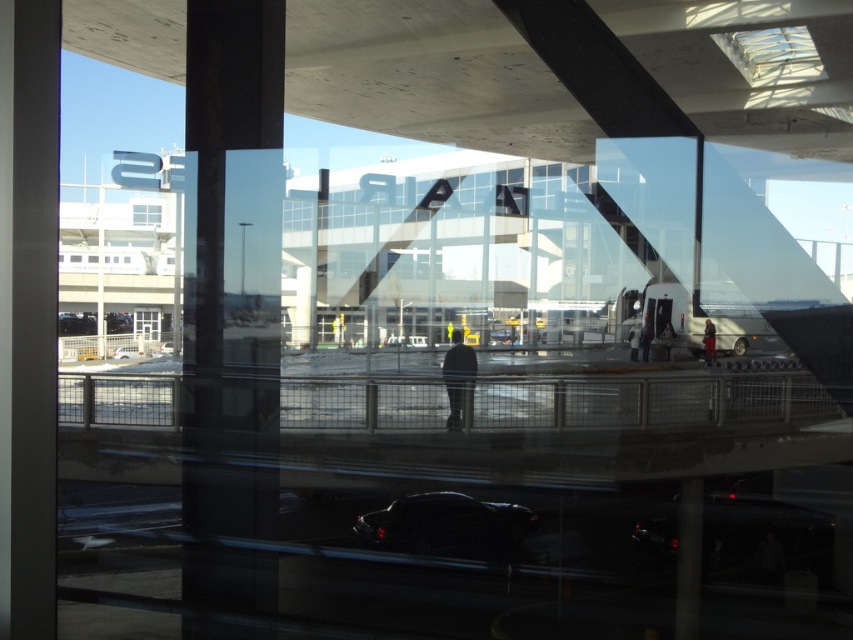
Which is below, black glossy car at lower right or clear glass window at center?

black glossy car at lower right

Can you confirm if black glossy car at lower right is thinner than clear glass window at center?

Correct, black glossy car at lower right's width is less than clear glass window at center's.

This screenshot has width=853, height=640. In order to click on black glossy car at lower right in this screenshot , I will do `click(764, 532)`.

The height and width of the screenshot is (640, 853). I want to click on black glossy car at lower right, so click(x=764, y=532).

How much distance is there between black glass pillar at center and shiny black car at center?

59.21 feet

Is point (206, 177) behind point (416, 522)?

No.

Between point (215, 266) and point (404, 545), which one is positioned behind?

Point (404, 545)

Locate an element on the screen. This screenshot has height=640, width=853. black glass pillar at center is located at coordinates (229, 328).

Who is more forward, (158, 323) or (78, 260)?

Point (158, 323)

Describe the element at coordinates (148, 323) in the screenshot. I see `clear glass window at center` at that location.

Is point (148, 310) positioned after point (73, 260)?

No, it is in front of (73, 260).

This screenshot has width=853, height=640. I want to click on clear glass window at center, so click(148, 323).